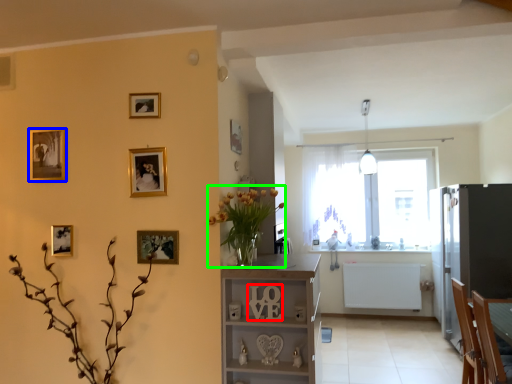
Question: Which object is positioned farthest from number (highlighted by a red box)? Select from picture frame (highlighted by a blue box) and floral arrangement (highlighted by a green box).

Choices:
 (A) picture frame
 (B) floral arrangement

Answer: (A)